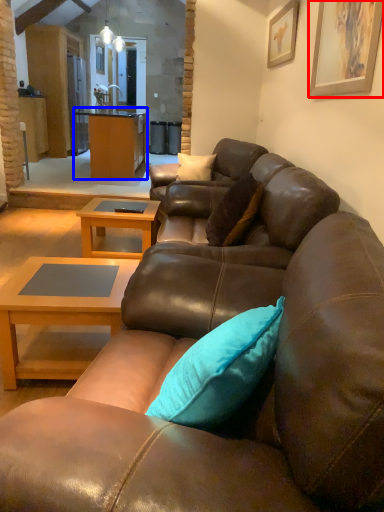
Question: Which of the following is the farthest to the observer, picture frame (highlighted by a red box) or cabinetry (highlighted by a blue box)?

Choices:
 (A) picture frame
 (B) cabinetry

Answer: (B)